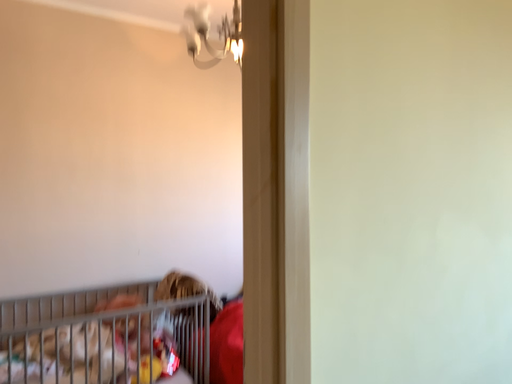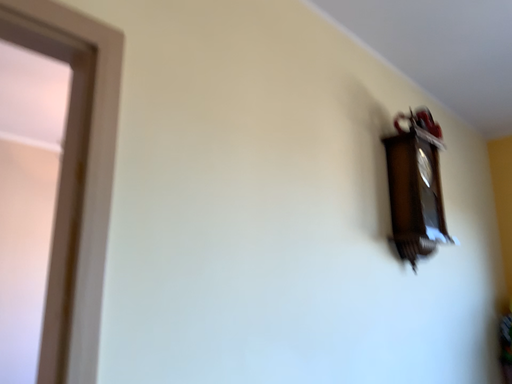
Question: How did the camera likely rotate when shooting the video?

Choices:
 (A) rotated upward
 (B) rotated downward

Answer: (A)